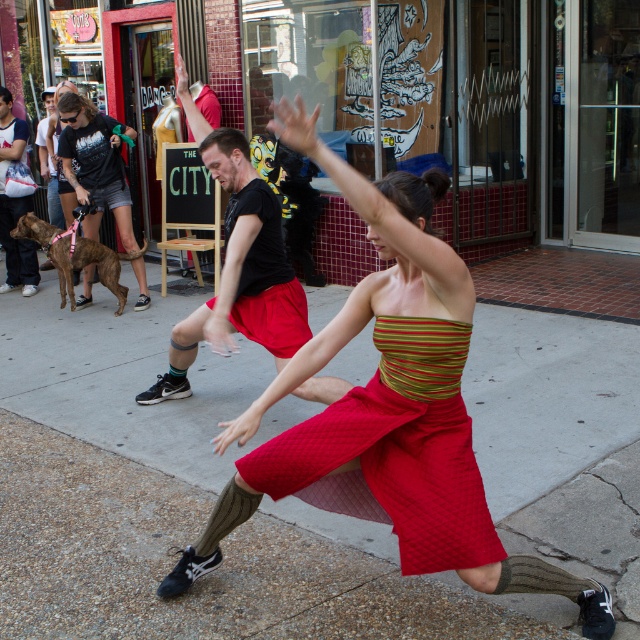
Who is shorter, smooth concrete pavement at center or quilted red dress at center?

smooth concrete pavement at center

Measure the distance between smooth concrete pavement at center and camera.

smooth concrete pavement at center and camera are 3.20 meters apart from each other.

Where is `smooth concrete pavement at center`? The image size is (640, 640). smooth concrete pavement at center is located at coordinates (172, 497).

This screenshot has height=640, width=640. What are the coordinates of `smooth concrete pavement at center` in the screenshot? It's located at (172, 497).

Does smooth concrete pavement at center appear under black cotton t-shirt at center?

Yes, smooth concrete pavement at center is below black cotton t-shirt at center.

Who is more distant from viewer, (131,570) or (234,230)?

Point (234,230)

You are a GUI agent. You are given a task and a screenshot of the screen. Output one action in this format:
    pyautogui.click(x=<x>, y=<y>)
    Task: Click on the smooth concrete pavement at center
    
    Given the screenshot: What is the action you would take?
    pyautogui.click(x=172, y=497)

Consider the image. Does quilted red dress at center appear under matte black t-shirt at left?

Indeed, quilted red dress at center is positioned under matte black t-shirt at left.

Who is more forward, [467,481] or [134,132]?

Point [467,481] is more forward.

Identify the location of quilted red dress at center. The width and height of the screenshot is (640, 640). (396, 449).